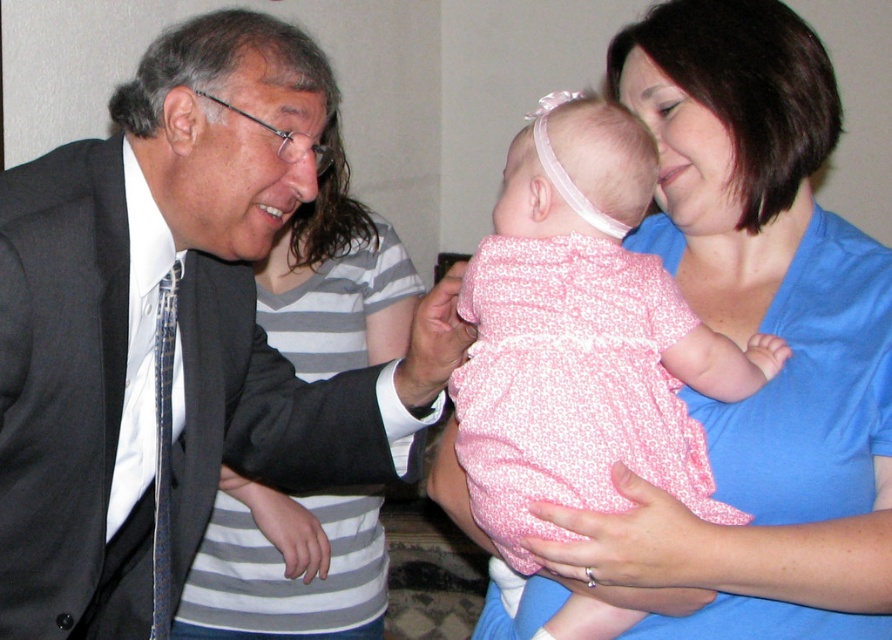
You are a photographer standing behind the camera. You want to focus on the matte black suit at center without the white satin shirt at left being visible in the frame. Is this possible based on their positions?

The matte black suit at center is in front of the white satin shirt at left, so yes, it is possible to focus on the matte black suit at center without the white satin shirt at left being visible by positioning the camera so the suit blocks the shirt from view.

You are a tailor measuring clothes for a client. You have a matte black suit at center and a white satin shirt at left. Which garment has a greater width?

The matte black suit at center has a greater width than the white satin shirt at left.